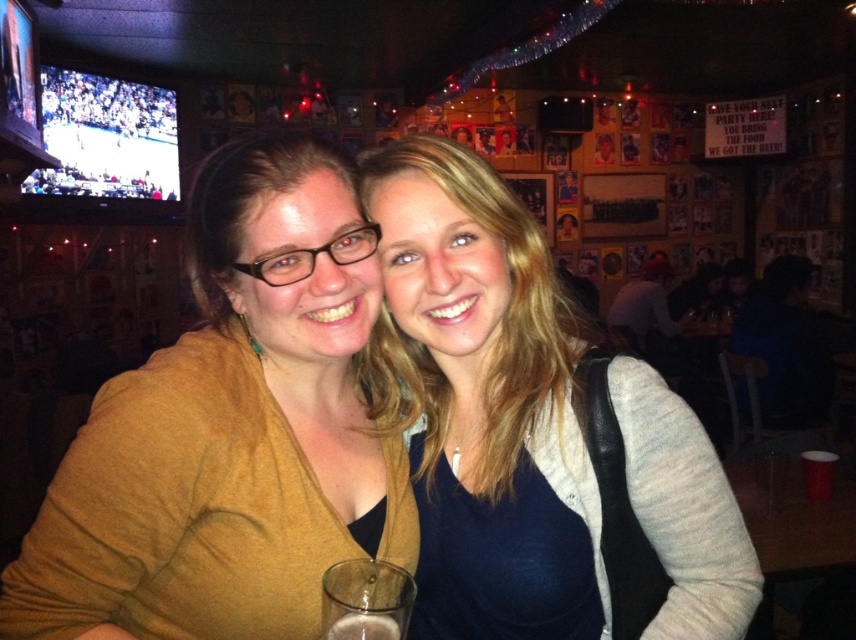
Can you confirm if clear glass at lower center is thinner than translucent glass at lower center?

In fact, clear glass at lower center might be wider than translucent glass at lower center.

Who is more distant from viewer, (355,636) or (382,632)?

Point (382,632)

Is point (400, 602) positioned before point (391, 630)?

No, (400, 602) is behind (391, 630).

You are a GUI agent. You are given a task and a screenshot of the screen. Output one action in this format:
    pyautogui.click(x=<x>, y=<y>)
    Task: Click on the clear glass at lower center
    The image size is (856, 640).
    Given the screenshot: What is the action you would take?
    pyautogui.click(x=366, y=600)

This screenshot has width=856, height=640. What do you see at coordinates (539, 433) in the screenshot?
I see `matte gray sweater at center` at bounding box center [539, 433].

Is matte gray sweater at center wider than translucent glass at lower center?

Yes.

The height and width of the screenshot is (640, 856). I want to click on matte gray sweater at center, so click(x=539, y=433).

Identify the location of matte gray sweater at center. click(x=539, y=433).

Between point (670, 500) and point (361, 634), which one is positioned in front?

Point (361, 634) is more forward.

Who is taller, matte gray sweater at center or clear glass at lower center?

Standing taller between the two is matte gray sweater at center.

What do you see at coordinates (539, 433) in the screenshot? I see `matte gray sweater at center` at bounding box center [539, 433].

Locate an element on the screen. This screenshot has width=856, height=640. matte gray sweater at center is located at coordinates pyautogui.click(x=539, y=433).